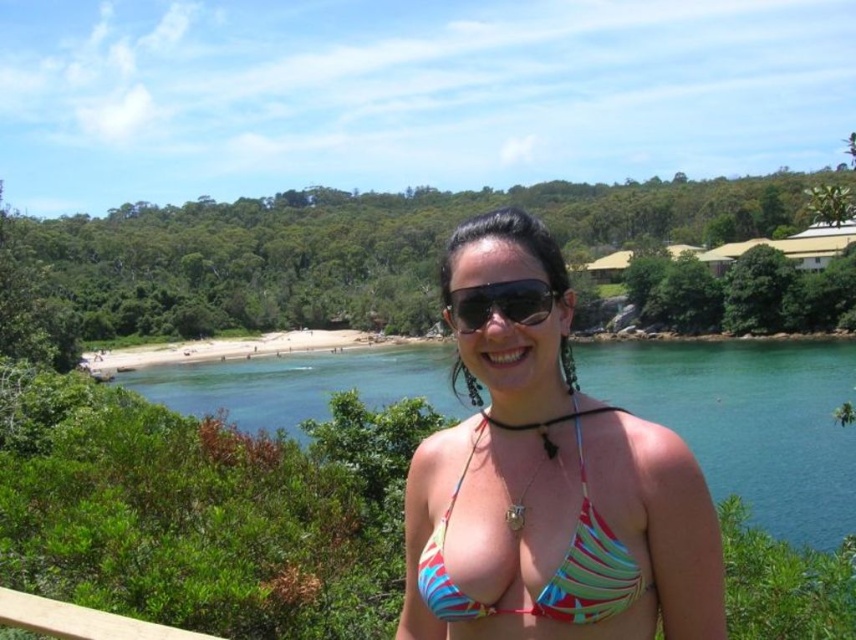
You are a photographer trying to capture the perfect shot of the person in the scene. You notice the multicolored fabric bikini top at center and the black plastic sunglasses at center. Which object is positioned to the right side of the other?

The multicolored fabric bikini top at center is to the right of the black plastic sunglasses at center.

You are a photographer trying to capture the perfect shot of the coastal landscape. You have two points marked on your camera screen at coordinates point (x=575, y=490) and point (x=489, y=294). Which point is closer to you, the photographer?

Point (x=575, y=490) is closer to the viewer than point (x=489, y=294).